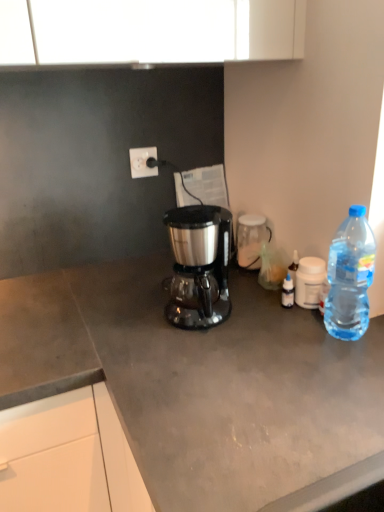
Find the location of `vacant area situated to the left side of satin black coffee maker at center`. vacant area situated to the left side of satin black coffee maker at center is located at coordinates (123, 320).